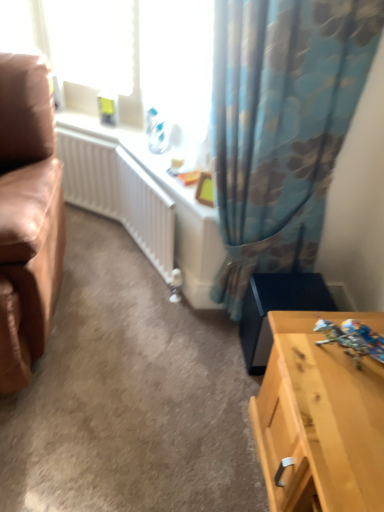
Question: In the image, is shiny metallic robot at lower right positioned in front of or behind leather at left?

Choices:
 (A) front
 (B) behind

Answer: (B)

Question: Is shiny metallic robot at lower right bigger or smaller than leather at left?

Choices:
 (A) big
 (B) small

Answer: (B)

Question: Which object is the closest to the light wood table at lower right?

Choices:
 (A) floral fabric curtain at upper right
 (B) white plastic window screen at upper left
 (C) leather at left
 (D) shiny metallic robot at lower right

Answer: (D)

Question: Estimate the real-world distances between objects in this image. Which object is farther from the leather at left?

Choices:
 (A) light wood table at lower right
 (B) floral fabric curtain at upper right
 (C) white plastic window screen at upper left
 (D) shiny metallic robot at lower right

Answer: (D)